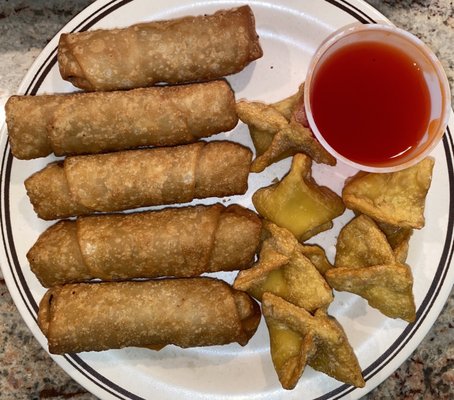
Image resolution: width=454 pixels, height=400 pixels. What are the coordinates of `arching light reflection on plate` in the screenshot? It's located at 298,14, 291,42.